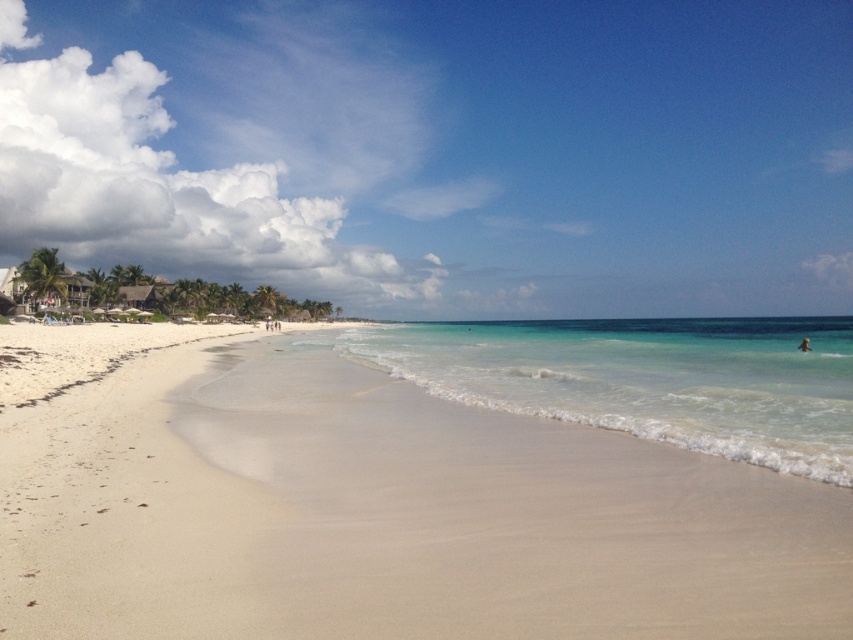
You are standing on the beach and want to walk to both points marked in the image. Which point, point (585, 616) or point (798, 346), would you reach first if you start walking straight ahead?

You would reach point (585, 616) first because it is closer to the viewer than point (798, 346).

You are standing on the white sand beach at center and looking towards the light skin human at lower right. Which direction should you walk to reach the human?

The light skin human at lower right is above the white sand beach at center, so you should walk upwards to reach them.